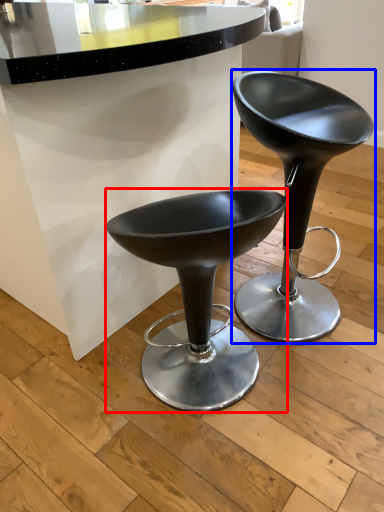
Question: Among these objects, which one is farthest to the camera, stool (highlighted by a red box) or stool (highlighted by a blue box)?

Choices:
 (A) stool
 (B) stool

Answer: (B)